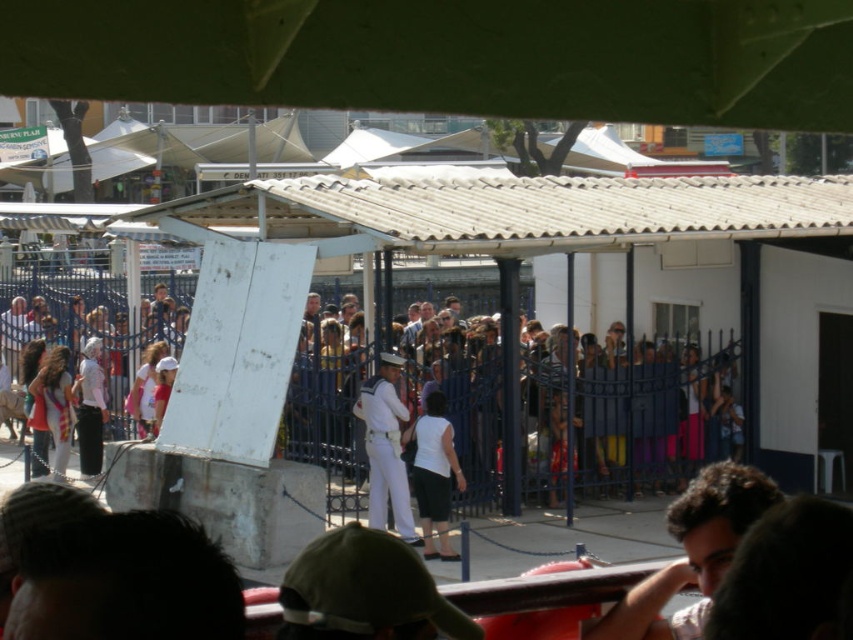
You are at the event and want to move from your current position to a friend standing at point (442, 394). There is an obstacle at point (700, 609). Can you walk directly to your friend without going around the obstacle?

Point (700, 609) is in front of point (442, 394), so the obstacle is blocking the path. You will need to go around it to reach your friend.

Based on the photo, you are at an event and see a person with brown hair at lower right and a white matte skirt at center. Which object is closer to you?

The brown hair at lower right is closer to you because it is positioned over the white matte skirt at center, indicating it is in a more forward spatial position.